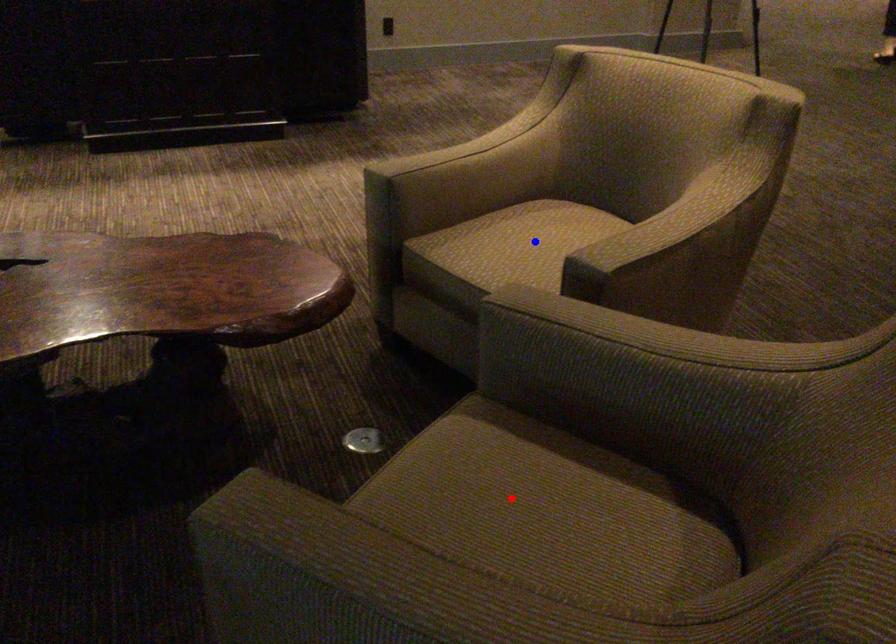
Question: In the image, two points are highlighted. Which point is nearer to the camera? Reply with the corresponding letter.

Choices:
 (A) blue point
 (B) red point

Answer: (B)